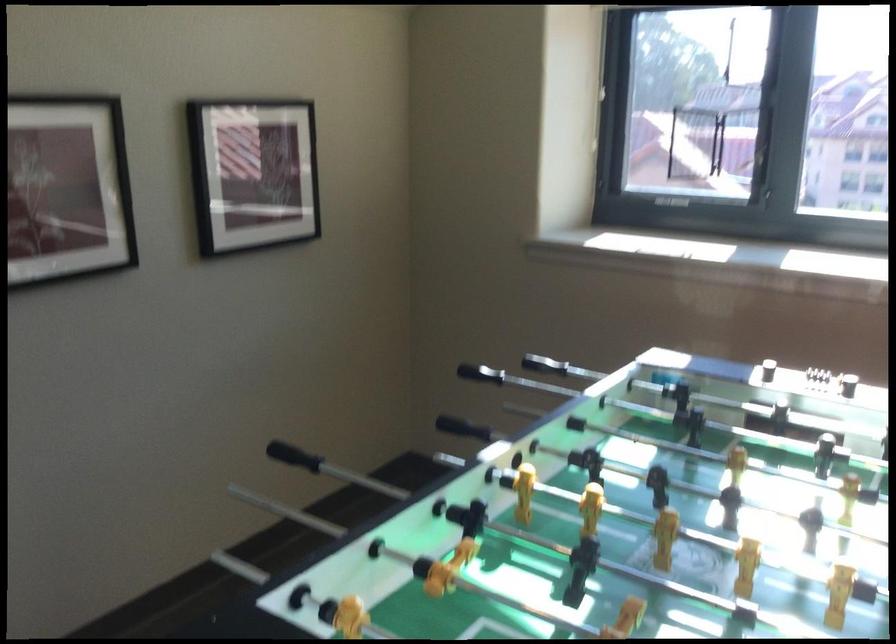
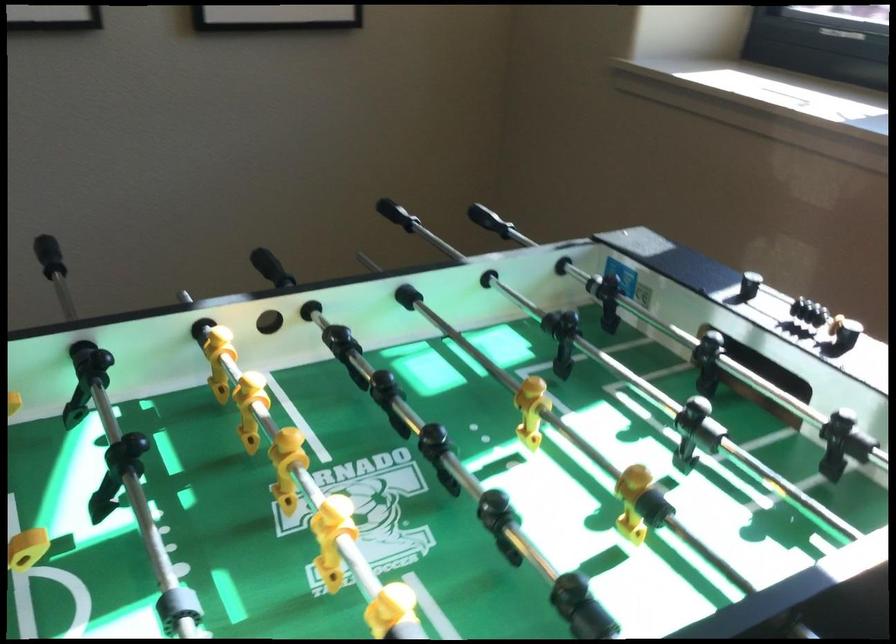
Find the pixel in the second image that matches point 70,486 in the first image.

(48, 256)